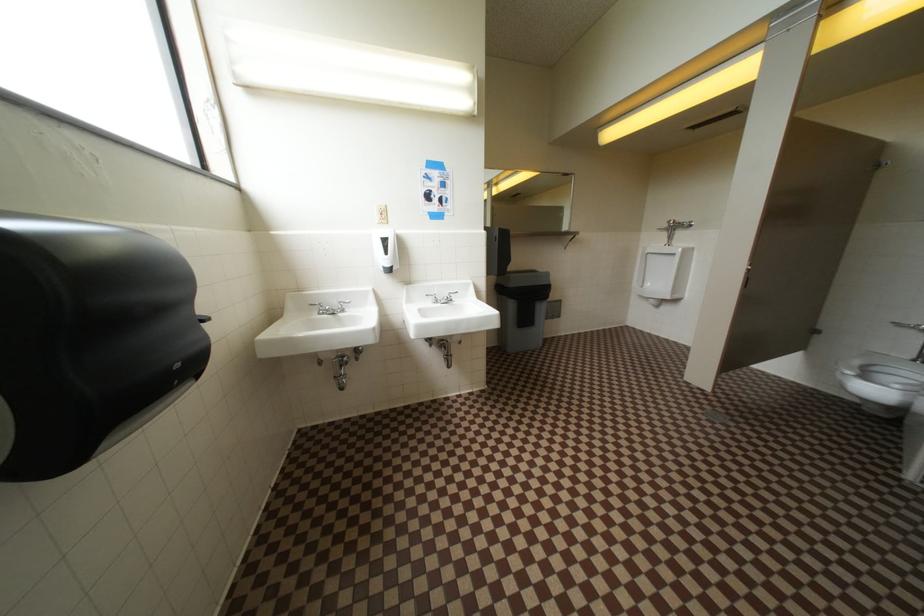
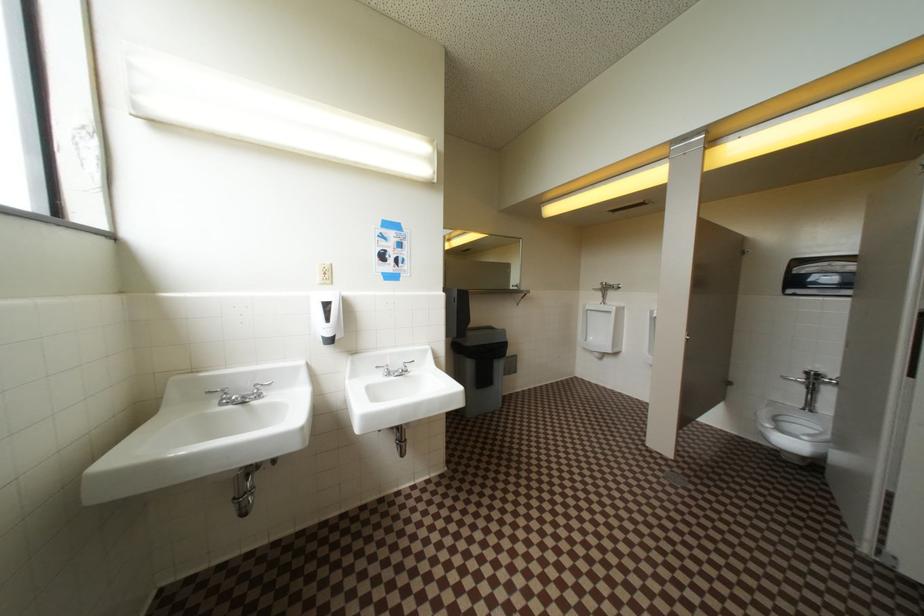
Question: Based on the continuous images, in which direction is the camera rotating? Reply with the corresponding letter.

Choices:
 (A) Left
 (B) Right
 (C) Up
 (D) Down

Answer: (B)